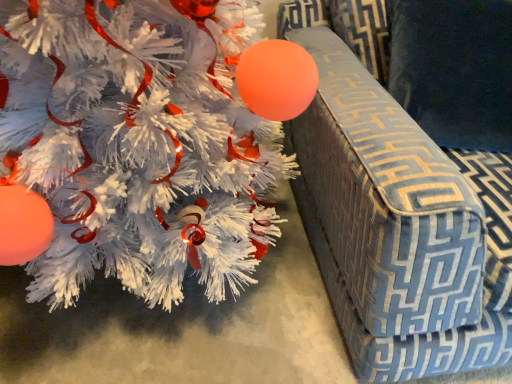
Question: Is blue patterned fabric armchair at right at the back of white matte christmas tree at left?

Choices:
 (A) no
 (B) yes

Answer: (A)

Question: Can you confirm if white matte christmas tree at left is wider than blue patterned fabric armchair at right?

Choices:
 (A) no
 (B) yes

Answer: (A)

Question: Are white matte christmas tree at left and blue patterned fabric armchair at right making contact?

Choices:
 (A) yes
 (B) no

Answer: (B)

Question: Considering the relative positions of white matte christmas tree at left and blue patterned fabric armchair at right in the image provided, is white matte christmas tree at left to the left of blue patterned fabric armchair at right from the viewer's perspective?

Choices:
 (A) yes
 (B) no

Answer: (A)

Question: Can you confirm if white matte christmas tree at left is taller than blue patterned fabric armchair at right?

Choices:
 (A) no
 (B) yes

Answer: (A)

Question: From a real-world perspective, is white matte christmas tree at left beneath blue patterned fabric armchair at right?

Choices:
 (A) no
 (B) yes

Answer: (B)

Question: Is blue patterned fabric armchair at right closer to the viewer compared to white matte christmas tree at left?

Choices:
 (A) yes
 (B) no

Answer: (A)

Question: Is white matte christmas tree at left inside blue patterned fabric armchair at right?

Choices:
 (A) no
 (B) yes

Answer: (A)

Question: From a real-world perspective, is blue patterned fabric armchair at right below white matte christmas tree at left?

Choices:
 (A) no
 (B) yes

Answer: (A)

Question: Is white matte christmas tree at left at the back of blue patterned fabric armchair at right?

Choices:
 (A) yes
 (B) no

Answer: (B)

Question: Does blue patterned fabric armchair at right have a larger size compared to white matte christmas tree at left?

Choices:
 (A) no
 (B) yes

Answer: (B)

Question: Is the position of blue patterned fabric armchair at right more distant than that of white matte christmas tree at left?

Choices:
 (A) no
 (B) yes

Answer: (A)

Question: Can we say velvety blue pillow at upper right lies outside white matte christmas tree at left?

Choices:
 (A) no
 (B) yes

Answer: (B)